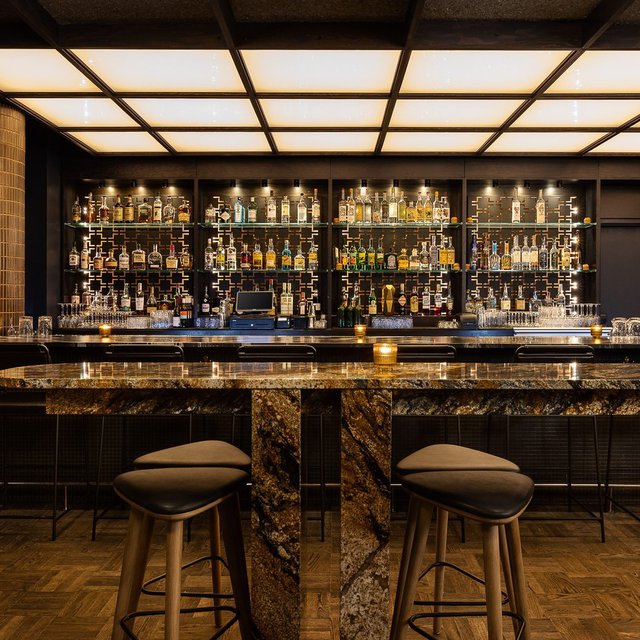
What are the coordinates of `top shelf liquor` in the screenshot? It's located at (131, 221), (265, 223), (388, 225), (518, 224).